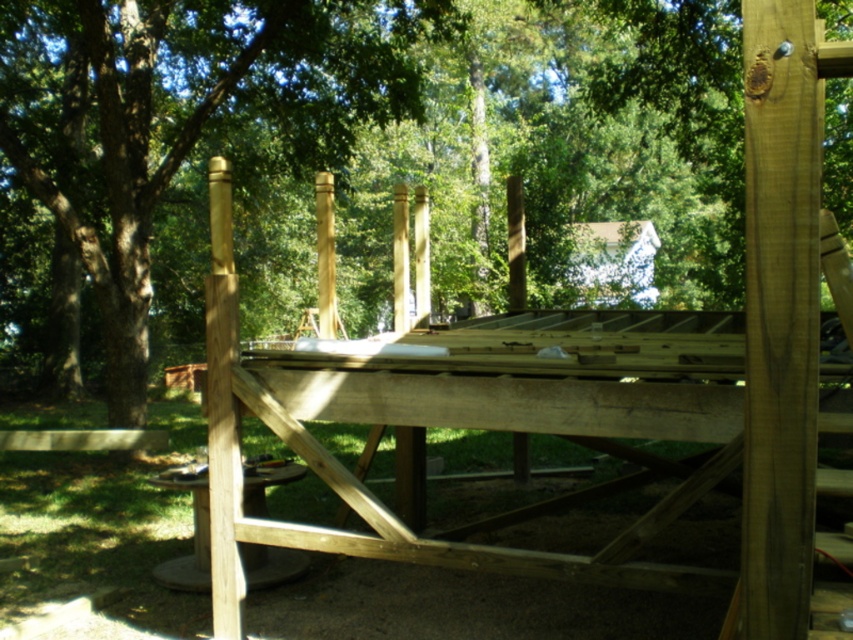
Is brown wood tree at upper center further to camera compared to natural wood picnic table at center?

Yes, it is behind natural wood picnic table at center.

The height and width of the screenshot is (640, 853). What do you see at coordinates (354, 147) in the screenshot?
I see `brown wood tree at upper center` at bounding box center [354, 147].

Which is in front, point (62, 118) or point (553, 392)?

Point (553, 392)

You are a GUI agent. You are given a task and a screenshot of the screen. Output one action in this format:
    pyautogui.click(x=<x>, y=<y>)
    Task: Click on the brown wood tree at upper center
    
    Given the screenshot: What is the action you would take?
    pyautogui.click(x=354, y=147)